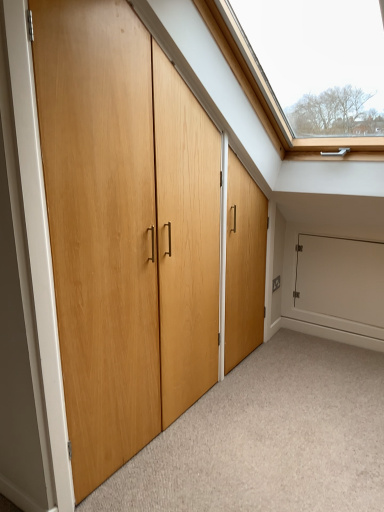
The image size is (384, 512). In order to click on vacant region below natural wood door at center (from a real-world perspective) in this screenshot , I will do coord(177,423).